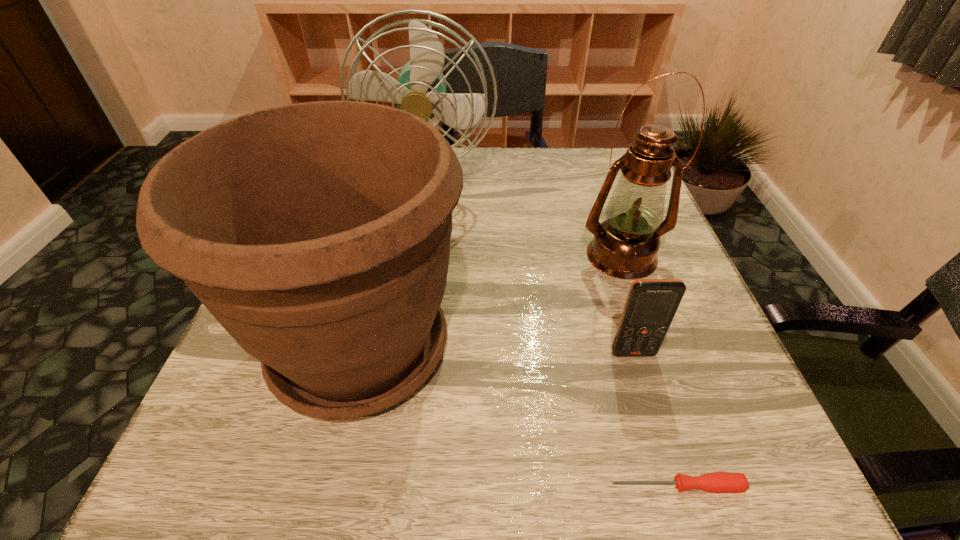
Where is `unoccupied area between the screwdriver and the farthest object`? Image resolution: width=960 pixels, height=540 pixels. unoccupied area between the screwdriver and the farthest object is located at coordinates (553, 338).

The height and width of the screenshot is (540, 960). I want to click on vacant space that's between the screwdriver and the flowerpot, so click(x=518, y=416).

At what (x,y) coordinates should I click in order to perform the action: click on vacant area that lies between the oil lamp and the flowerpot. Please return your answer as a coordinate pair (x, y). The width and height of the screenshot is (960, 540). Looking at the image, I should click on (491, 301).

This screenshot has width=960, height=540. Identify the location of vacant area between the nearest object and the flowerpot. (518, 416).

The height and width of the screenshot is (540, 960). I want to click on unoccupied area between the oil lamp and the farthest object, so click(525, 223).

Image resolution: width=960 pixels, height=540 pixels. Identify the location of the third closest object to the cellular telephone. (317, 234).

Where is `the third closest object relative to the fan`? the third closest object relative to the fan is located at coordinates (651, 305).

Locate an element on the screen. The image size is (960, 540). vacant region that satisfies the following two spatial constraints: 1. on the back side of the flowerpot; 2. on the left side of the oil lamp is located at coordinates (382, 256).

In order to click on vacant region that satisfies the following two spatial constraints: 1. on the back side of the flowerpot; 2. on the left side of the oil lamp in this screenshot , I will do `click(382, 256)`.